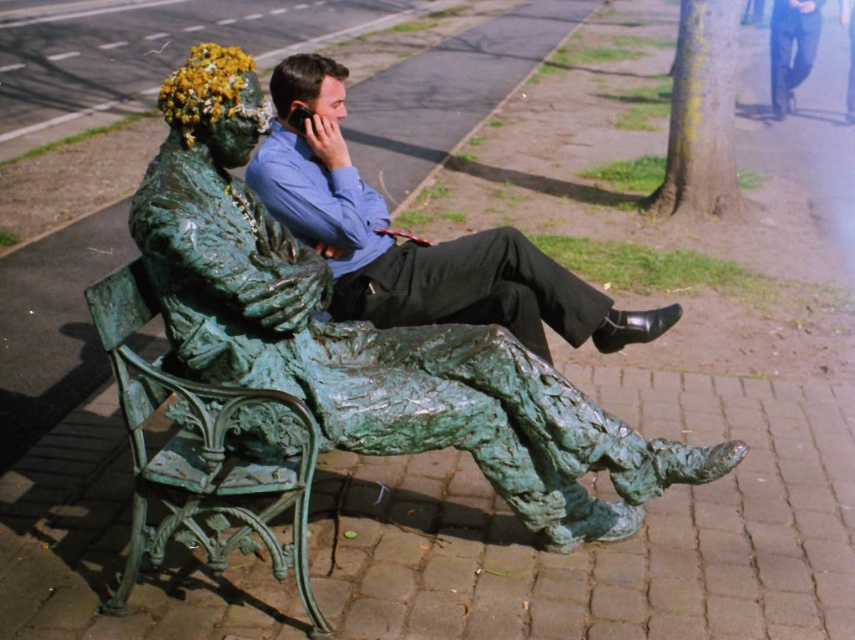
Is point (211, 148) farther from camera compared to point (385, 316)?

No, it is not.

Between green patinated bronze statue at center and matte green statue at center, which one is positioned lower?

green patinated bronze statue at center is lower down.

Between point (525, 499) and point (511, 248), which one is positioned in front?

Point (525, 499) is in front.

Locate an element on the screen. green patinated bronze statue at center is located at coordinates (369, 336).